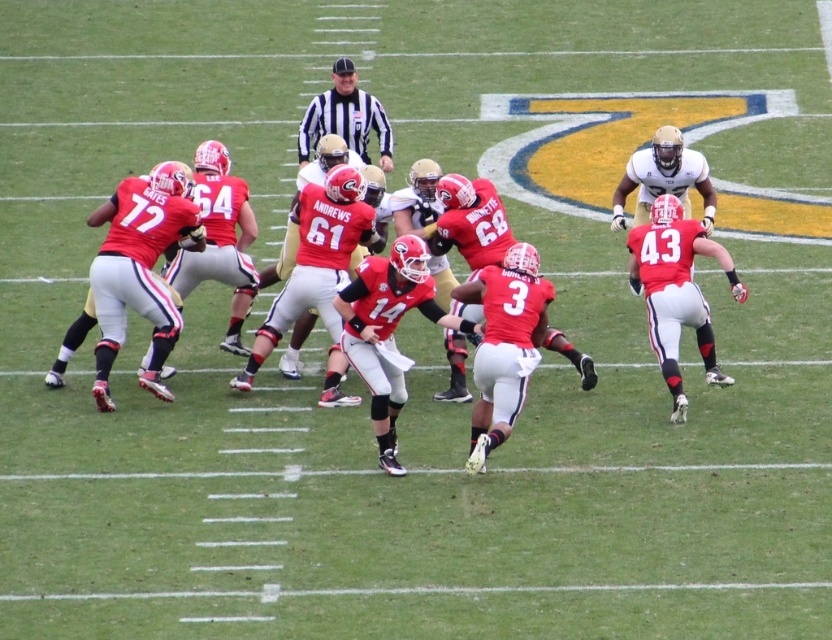
Question: Observing the image, what is the correct spatial positioning of matte red jersey at right in reference to striped jersey referee at center?

Choices:
 (A) below
 (B) above

Answer: (A)

Question: Among these points, which one is farthest from the camera?

Choices:
 (A) (692, 296)
 (B) (340, 80)

Answer: (B)

Question: Does matte red jersey at center appear under matte red jersey at right?

Choices:
 (A) yes
 (B) no

Answer: (B)

Question: Among these objects, which one is farthest from the camera?

Choices:
 (A) striped jersey referee at center
 (B) matte red jersey at center
 (C) matte red jersey at right

Answer: (A)

Question: Which object appears closest to the camera in this image?

Choices:
 (A) matte red jersey at center
 (B) striped jersey referee at center
 (C) matte red jersey at right

Answer: (A)

Question: Can you confirm if matte red jersey at center is smaller than striped jersey referee at center?

Choices:
 (A) yes
 (B) no

Answer: (B)